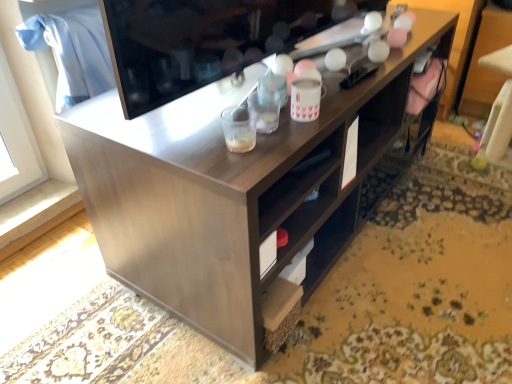
The image size is (512, 384). I want to click on free point to the right of translucent plastic cup at center, the second beverage when ordered from back to front, so click(291, 136).